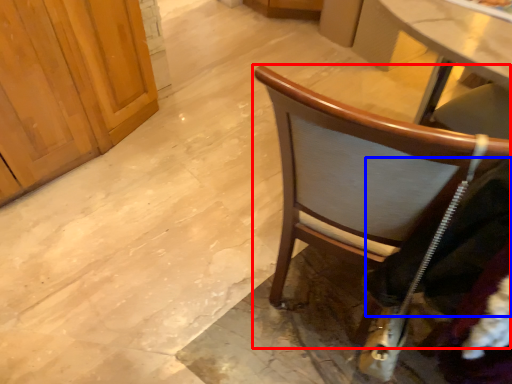
Question: Which point is closer to the camera, chair (highlighted by a red box) or clothing (highlighted by a blue box)?

Choices:
 (A) chair
 (B) clothing

Answer: (B)